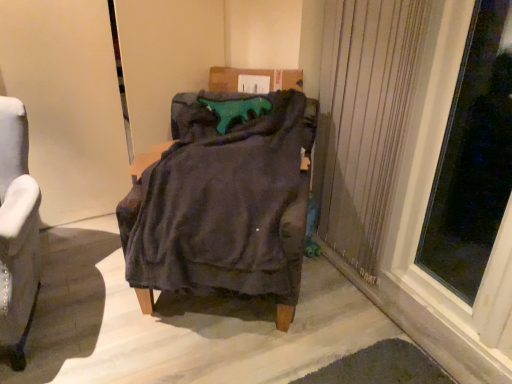
Where is `free point in front of beige textured curtain at right`? free point in front of beige textured curtain at right is located at coordinates (390, 297).